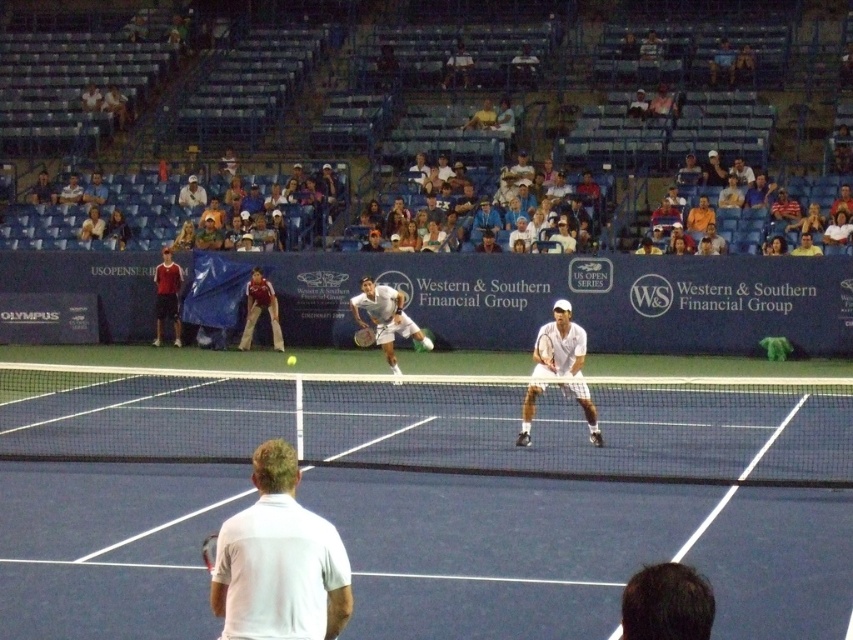
Question: Does white cotton shirt at upper center have a greater width compared to white fabric shirt at upper center?

Choices:
 (A) no
 (B) yes

Answer: (B)

Question: Which of the following is the farthest from the observer?

Choices:
 (A) (576, 364)
 (B) (358, 308)
 (C) (260, 484)
 (D) (258, 278)

Answer: (D)

Question: Can you confirm if white fabric shirt at upper center is smaller than light brown leather jacket at upper center?

Choices:
 (A) yes
 (B) no

Answer: (A)

Question: Which object appears farthest from the camera in this image?

Choices:
 (A) white fabric shirt at upper center
 (B) matte brown pants at lower left
 (C) blue synthetic turf at center

Answer: (A)

Question: Among these objects, which one is farthest from the camera?

Choices:
 (A) matte brown pants at lower left
 (B) white fabric shirt at upper center

Answer: (B)

Question: Is the position of matte red shirt at left more distant than that of matte brown pants at lower left?

Choices:
 (A) no
 (B) yes

Answer: (B)